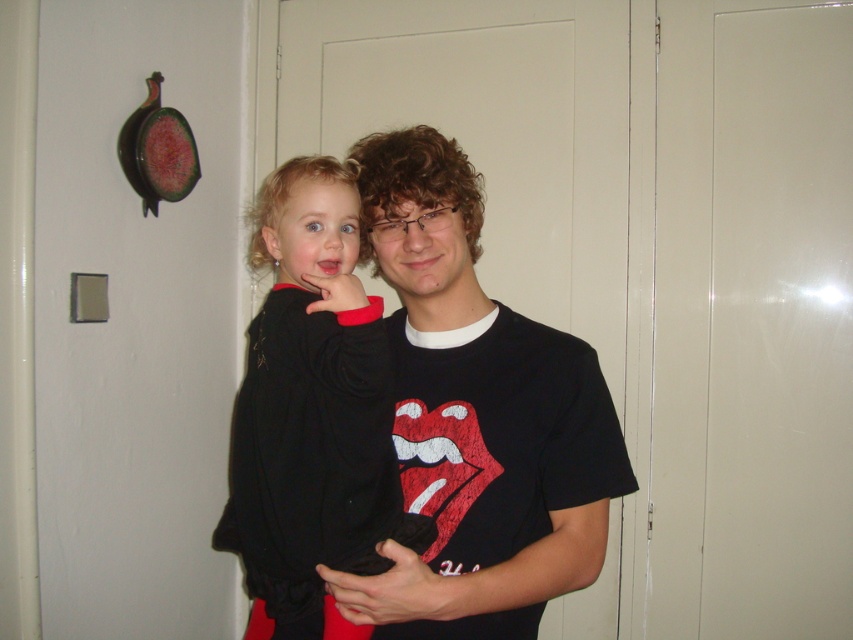
Consider the image. You are standing in a hallway and want to reach the point marked at coordinates (431, 216). The light switch plate is on the wall to your left. Can you estimate how far you need to walk to reach that point?

The distance between you and the point marked at coordinates (431, 216) is 1.15 meters, so you need to walk approximately 1.15 meters to reach it.

You are standing in a hallway and see two points marked on the wall. The first point is at coordinate point [393,433] and the second is at point [283,636]. Which point is closer to you?

Point [283,636] is closer to you because it is nearer to the camera than point [393,433].